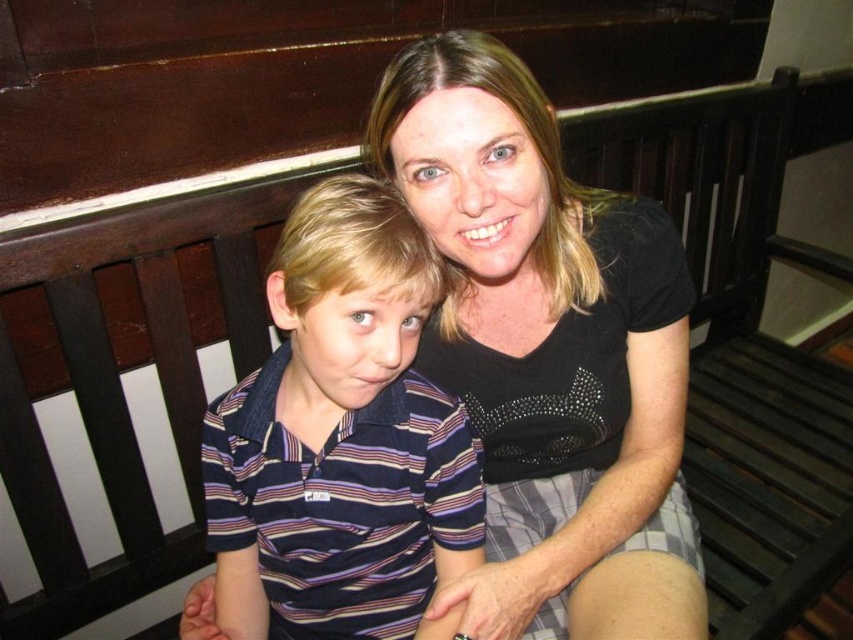
You are a photographer trying to capture a closeup of the black matte shirt at upper center and the striped cotton shirt at left. Which shirt should you focus on first if you want to ensure both are in focus without moving the camera?

The striped cotton shirt at left is lower than the black matte shirt at upper center, so you should focus on the striped cotton shirt at left first to ensure both are in focus.

You are trying to determine the spatial relationship between the two people in the image. Which shirt is positioned closer to the camera, the striped cotton shirt at left or the black matte shirt at upper center?

The striped cotton shirt at left is behind the black matte shirt at upper center, so the black matte shirt at upper center is closer to the camera.

You are standing in front of the bench and want to place a small plant pot between the two points, point (x=509, y=358) and point (x=422, y=408). Which point should you place it closer to so that it appears closer to the viewer?

You should place the plant pot closer to point (x=509, y=358) because it is further to the viewer than point (x=422, y=408), making it appear closer.